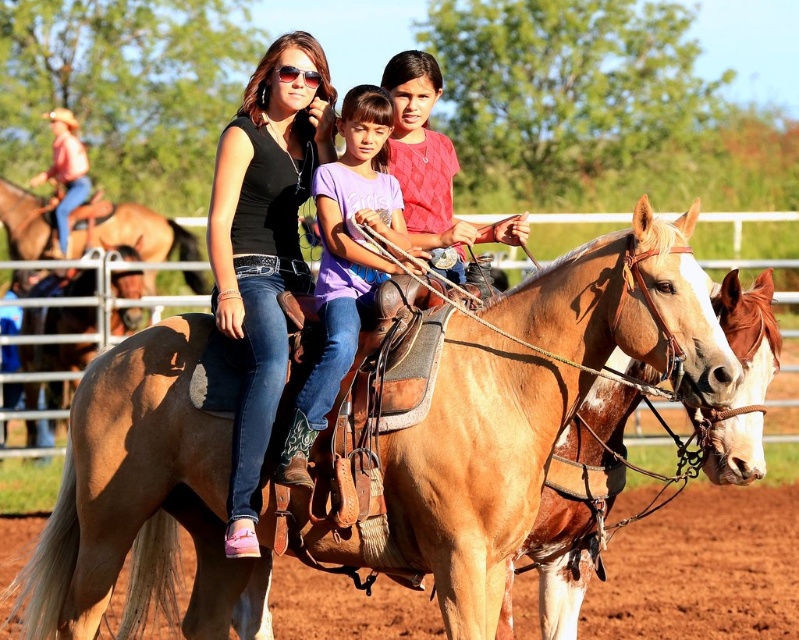
You are a photographer standing 5 meters away from the matte black shirt at center. You want to take a photo of the brown leather saddle at upper left. Can you reach it with your camera lens that has a maximum zoom range of 10 meters? Please explain your reasoning.

The distance between the matte black shirt at center and the brown leather saddle at upper left is 9.03 meters. Since the photographer is already 5 meters away from the matte black shirt at center, the total distance to the brown leather saddle at upper left would be 5 meters plus 9.03 meters, totaling 14.03 meters. The camera lens can only zoom up to 10 meters, so it would not be sufficient to capture the brown leather saddle at upper left clearly.